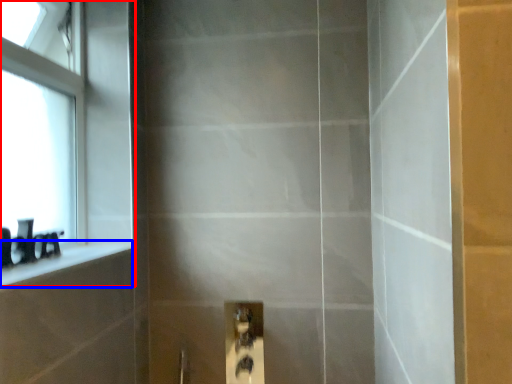
Question: Which object appears farthest to the camera in this image, window (highlighted by a red box) or ledge (highlighted by a blue box)?

Choices:
 (A) window
 (B) ledge

Answer: (A)